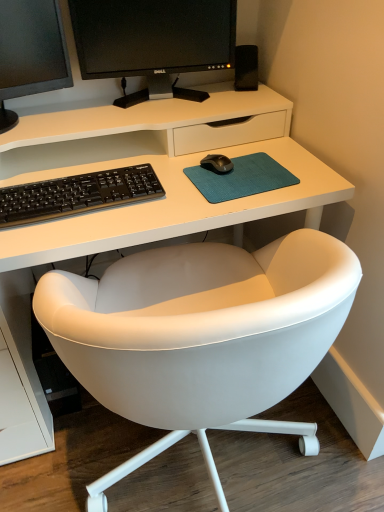
Question: Is black matte speaker at upper right wider or thinner than black glossy monitor at upper left, the first computer monitor in the left-to-right sequence?

Choices:
 (A) thin
 (B) wide

Answer: (A)

Question: Considering the positions of point (243, 73) and point (52, 45), is point (243, 73) closer or farther from the camera than point (52, 45)?

Choices:
 (A) closer
 (B) farther

Answer: (B)

Question: Estimate the real-world distances between objects in this image. Which object is farther from the white leather chair at center?

Choices:
 (A) black matte keyboard at center
 (B) black matte speaker at upper right
 (C) black glossy monitor at upper center, marked as the 1th computer monitor in a right-to-left arrangement
 (D) black glossy monitor at upper left, which is counted as the second computer monitor, starting from the right
 (E) teal fabric mousepad at center

Answer: (B)

Question: Which object is the farthest from the white leather chair at center?

Choices:
 (A) black glossy monitor at upper center, marked as the 1th computer monitor in a right-to-left arrangement
 (B) black glossy monitor at upper left, the first computer monitor in the left-to-right sequence
 (C) black matte keyboard at center
 (D) black matte speaker at upper right
 (E) teal fabric mousepad at center

Answer: (D)